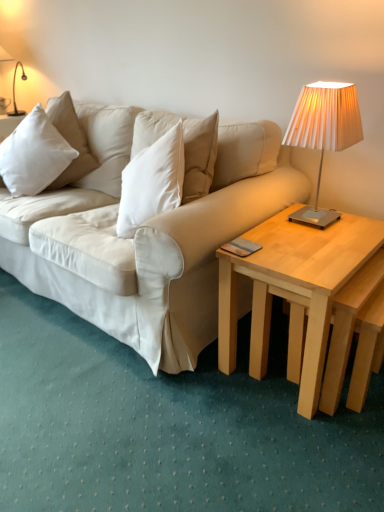
Find the location of `blank space above light wood/natural wood coffee table at right (from a real-world perspective)`. blank space above light wood/natural wood coffee table at right (from a real-world perspective) is located at coordinates (316, 238).